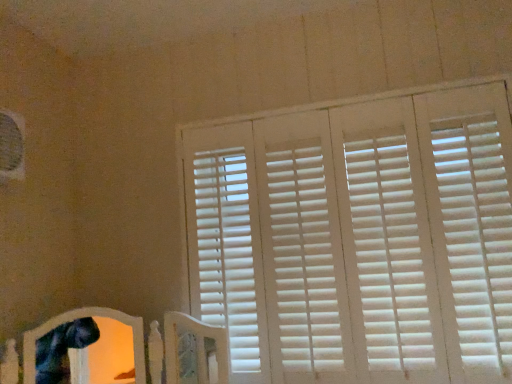
Question: Is white matte blinds at upper right situated inside white wood bed frame at lower left or outside?

Choices:
 (A) outside
 (B) inside

Answer: (A)

Question: From a real-world perspective, is white matte blinds at upper right physically located above or below white wood bed frame at lower left?

Choices:
 (A) below
 (B) above

Answer: (B)

Question: Based on their positions, is white matte blinds at upper right located to the left or right of white wood bed frame at lower left?

Choices:
 (A) left
 (B) right

Answer: (B)

Question: In the image, is white wood bed frame at lower left on the left side or the right side of white matte blinds at upper right?

Choices:
 (A) left
 (B) right

Answer: (A)

Question: Is white wood bed frame at lower left wider or thinner than white matte blinds at upper right?

Choices:
 (A) wide
 (B) thin

Answer: (A)

Question: From the image's perspective, is white wood bed frame at lower left located above or below white matte blinds at upper right?

Choices:
 (A) below
 (B) above

Answer: (A)

Question: Based on their sizes in the image, would you say white wood bed frame at lower left is bigger or smaller than white matte blinds at upper right?

Choices:
 (A) small
 (B) big

Answer: (A)